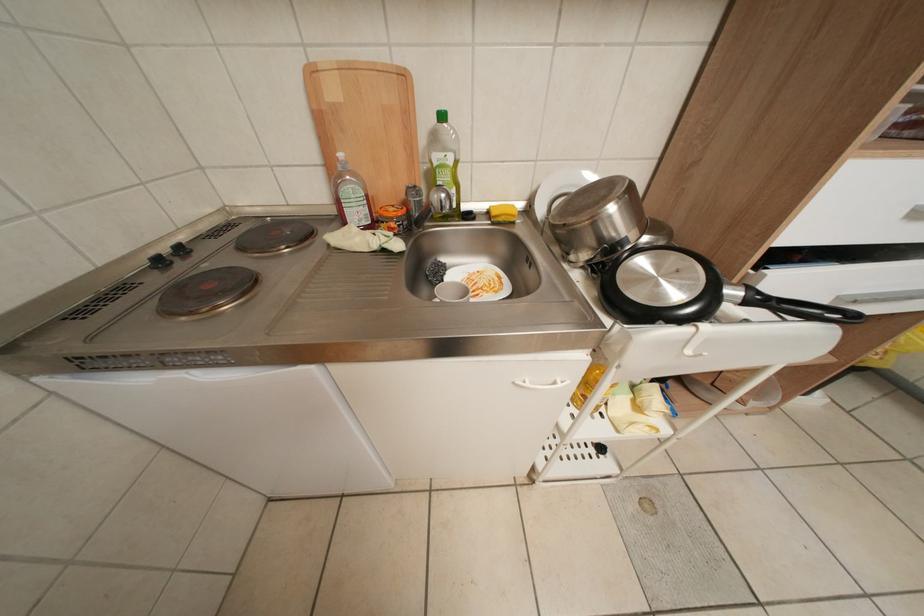
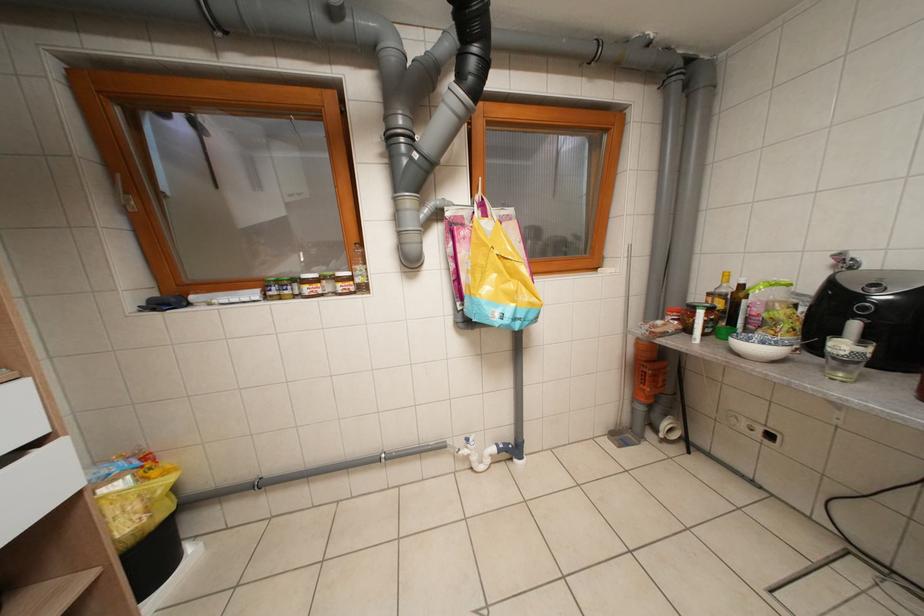
Question: The camera is either moving clockwise (left) or counter-clockwise (right) around the object. The first image is from the beginning of the video and the second image is from the end. Is the camera moving left or right when shooting the video?

Choices:
 (A) Left
 (B) Right

Answer: (A)